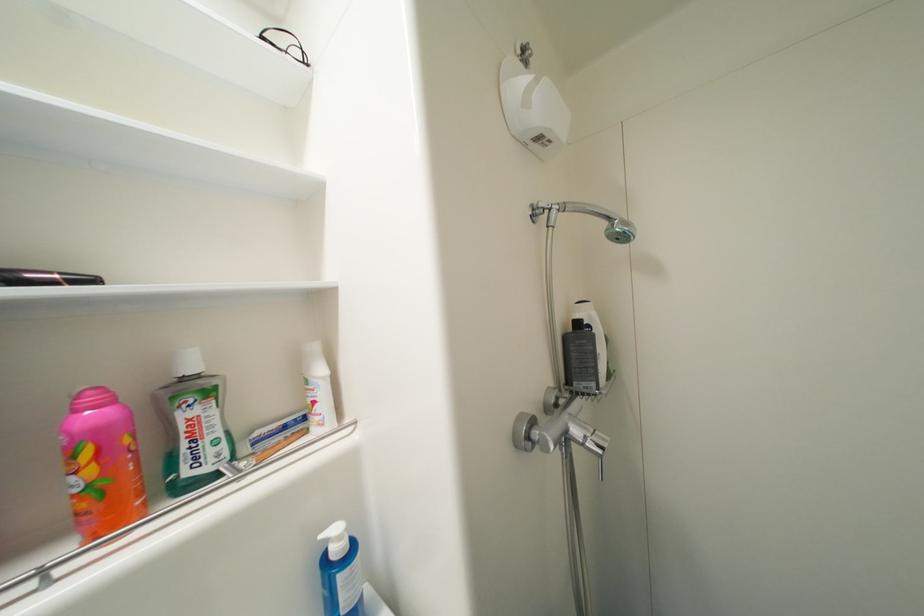
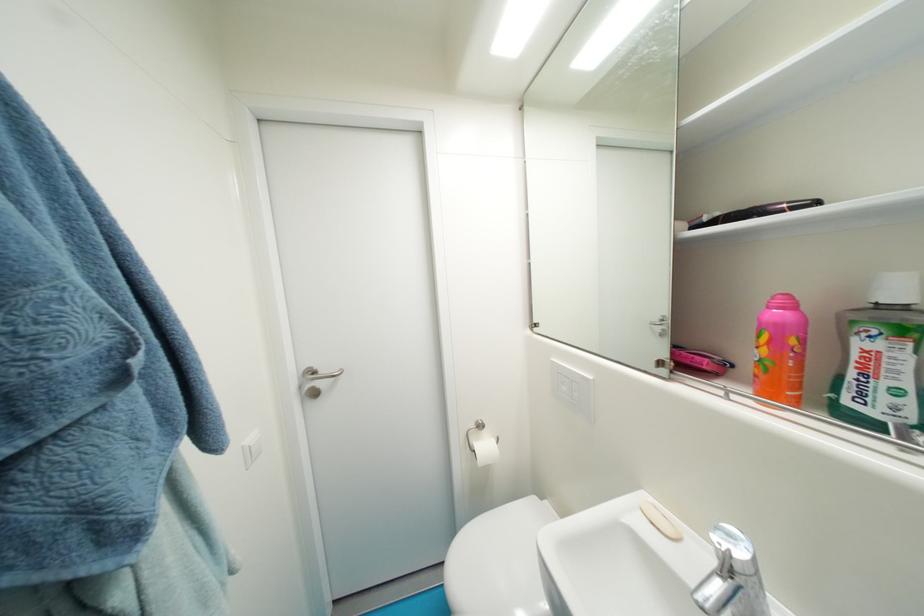
In the second image, find the point that corresponds to (x=190, y=447) in the first image.

(858, 376)